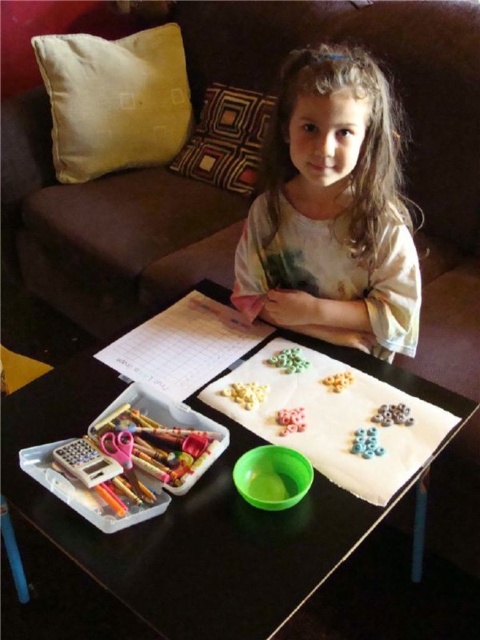
You are standing in front of the table and want to reach two points on the table. The first point is at coordinates point (204,611) and the second is at point (315,356). Which point is closer to you?

Point (204,611) is closer to the viewer than point (315,356).